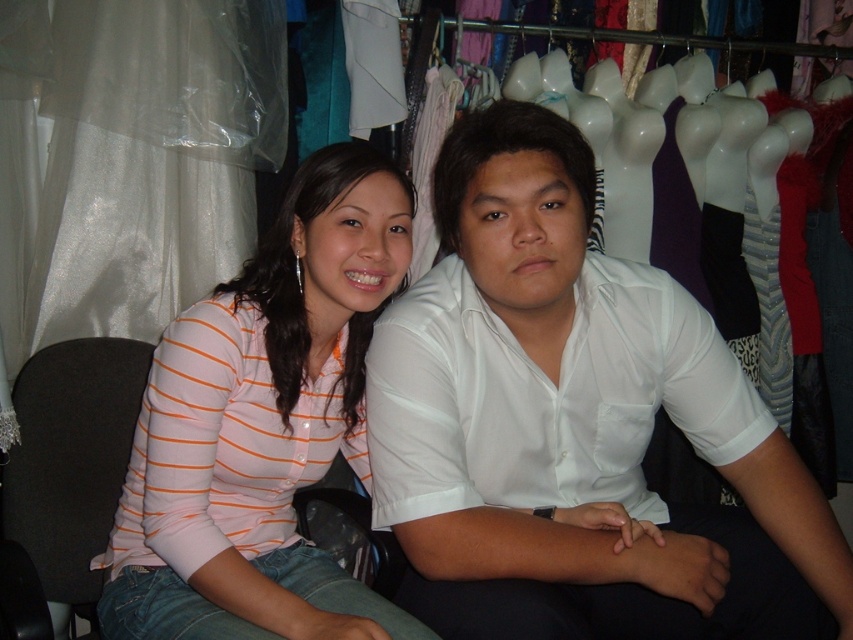
You are trying to decide whether to purchase the pink striped shirt at center to use as a tablecloth. The table you have is the same size as the black fabric chair at left. Will the shirt be large enough to cover the table?

The pink striped shirt at center has a width larger than the black fabric chair at left, so it should be large enough to cover the table.

You are a salesperson in a clothing store. You need to place a price tag at the point with coordinates (575,426). According to the image, where exactly should you place the price tag?

The point at coordinates (575,426) is on the white smooth shirt at center, so you should place the price tag on the white smooth shirt at center.

You are standing in a store with two people. The woman is wearing a light pink long sleeved shirt with orange horizontal stripes and blue jeans. The man is wearing a white short sleeved button up shirt and dark pants. There is a point at coordinates (575, 426). Which person is this point on?

The point at coordinates (575, 426) is on the white smooth shirt at center, which belongs to the man in the white short sleeved button up shirt.